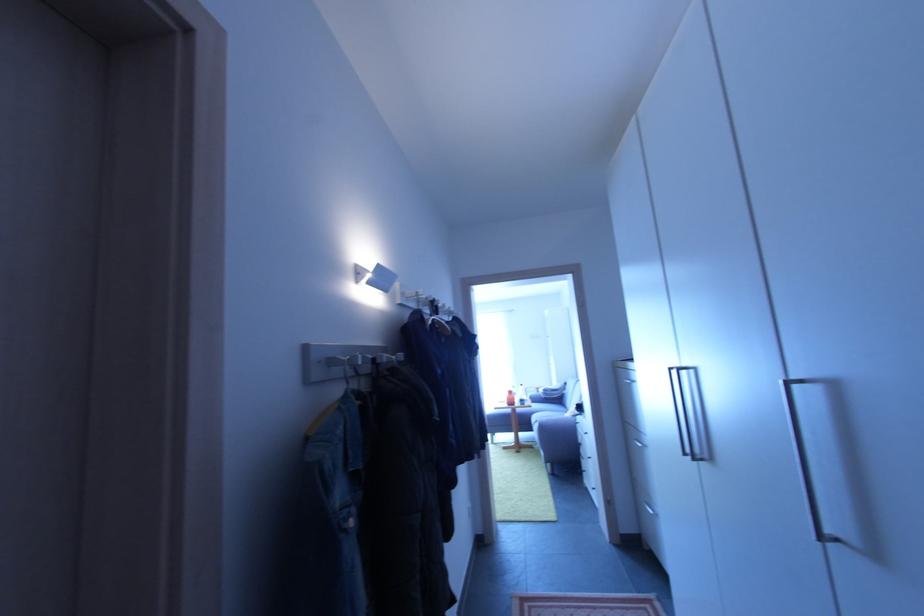
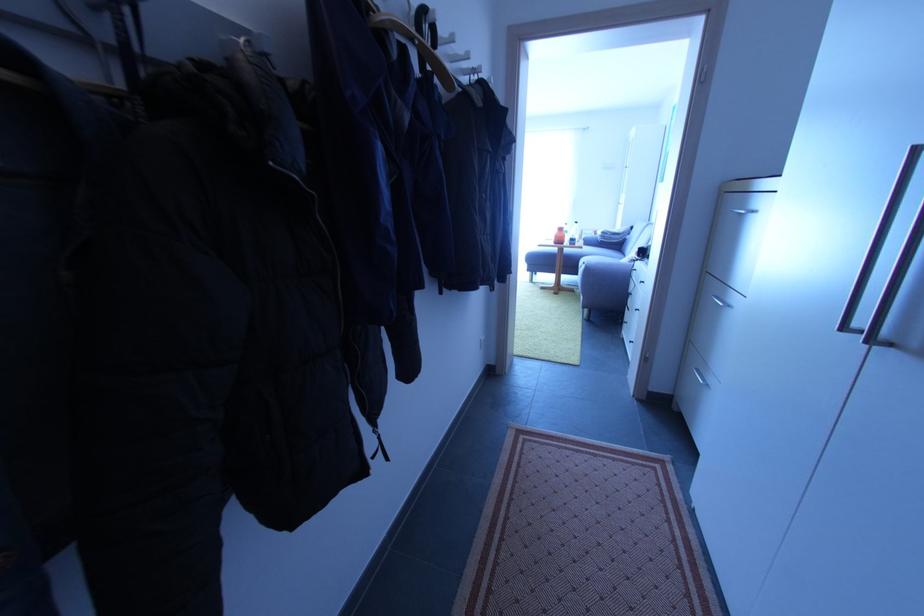
The point at (657, 514) is marked in the first image. Where is the corresponding point in the second image?

(706, 383)